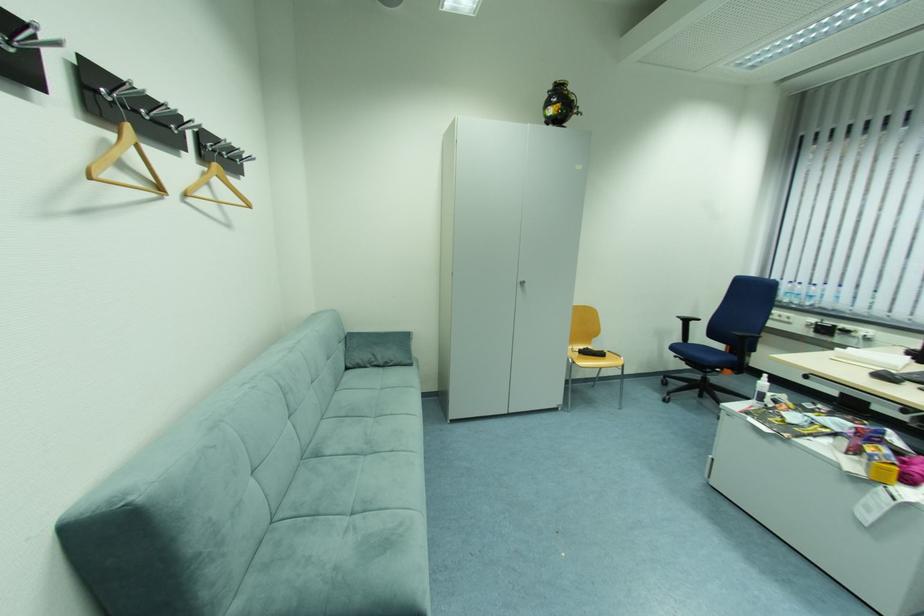
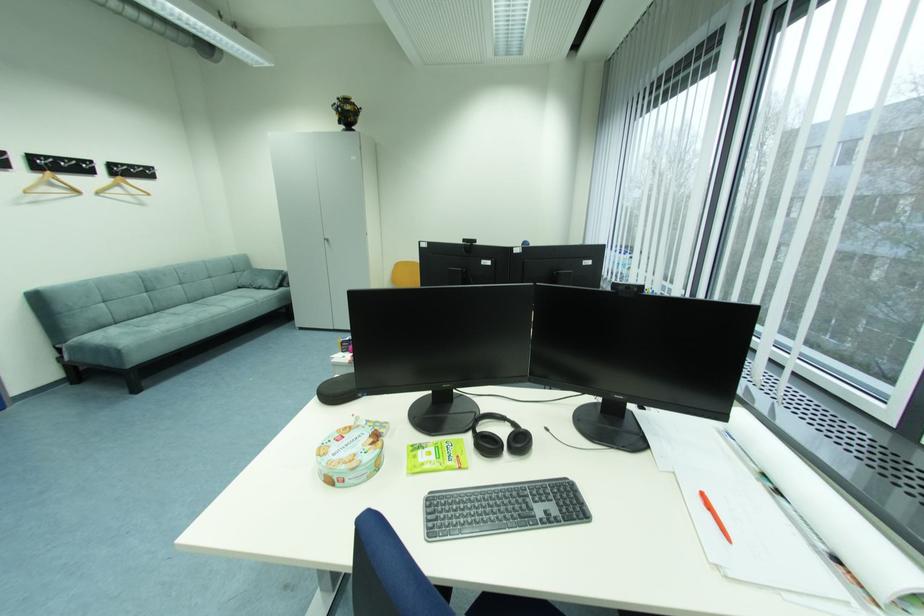
Where in the second image is the point corresponding to the point at 127,166 from the first image?

(59, 185)